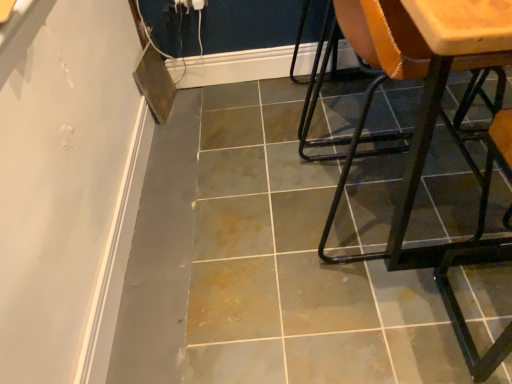
Question: From the image's perspective, is gray tile floor at center located above metallic orange chair at right, which ranks as the 2th chair in left-to-right order?

Choices:
 (A) yes
 (B) no

Answer: (A)

Question: From the image's perspective, does gray tile floor at center appear lower than metallic orange chair at right, which ranks as the 2th chair in right-to-left order?

Choices:
 (A) no
 (B) yes

Answer: (A)

Question: From a real-world perspective, is gray tile floor at center over metallic orange chair at right, which ranks as the 2th chair in right-to-left order?

Choices:
 (A) yes
 (B) no

Answer: (B)

Question: Does gray tile floor at center have a larger size compared to metallic orange chair at right, which ranks as the 2th chair in right-to-left order?

Choices:
 (A) yes
 (B) no

Answer: (A)

Question: Does gray tile floor at center have a lesser height compared to metallic orange chair at right, which ranks as the 2th chair in left-to-right order?

Choices:
 (A) yes
 (B) no

Answer: (A)

Question: Is wooden seat at right, arranged as the 1th chair when viewed from the right, bigger or smaller than gray tile floor at center?

Choices:
 (A) small
 (B) big

Answer: (B)

Question: Considering their positions, is wooden seat at right, arranged as the 1th chair when viewed from the right, located in front of or behind gray tile floor at center?

Choices:
 (A) behind
 (B) front

Answer: (B)

Question: From their relative heights in the image, would you say wooden seat at right, acting as the 3th chair starting from the left, is taller or shorter than gray tile floor at center?

Choices:
 (A) short
 (B) tall

Answer: (B)

Question: Is wooden seat at right, acting as the 3th chair starting from the left, inside the boundaries of gray tile floor at center, or outside?

Choices:
 (A) inside
 (B) outside

Answer: (B)

Question: From the image's perspective, is matte orange chair at right, positioned as the third chair in right-to-left order, located above or below metallic orange chair at right, which ranks as the 2th chair in left-to-right order?

Choices:
 (A) above
 (B) below

Answer: (A)

Question: Is matte orange chair at right, positioned as the third chair in right-to-left order, to the left or to the right of metallic orange chair at right, which ranks as the 2th chair in left-to-right order, in the image?

Choices:
 (A) left
 (B) right

Answer: (A)

Question: Considering the positions of matte orange chair at right, the first chair in the left-to-right sequence, and metallic orange chair at right, which ranks as the 2th chair in left-to-right order, in the image, is matte orange chair at right, the first chair in the left-to-right sequence, taller or shorter than metallic orange chair at right, which ranks as the 2th chair in left-to-right order,?

Choices:
 (A) short
 (B) tall

Answer: (A)

Question: Does point (397, 145) appear closer or farther from the camera than point (502, 135)?

Choices:
 (A) farther
 (B) closer

Answer: (A)

Question: Looking at their shapes, would you say gray tile floor at center is wider or thinner than matte orange chair at right, positioned as the third chair in right-to-left order?

Choices:
 (A) thin
 (B) wide

Answer: (B)

Question: In the image, is gray tile floor at center on the left side or the right side of matte orange chair at right, positioned as the third chair in right-to-left order?

Choices:
 (A) left
 (B) right

Answer: (A)